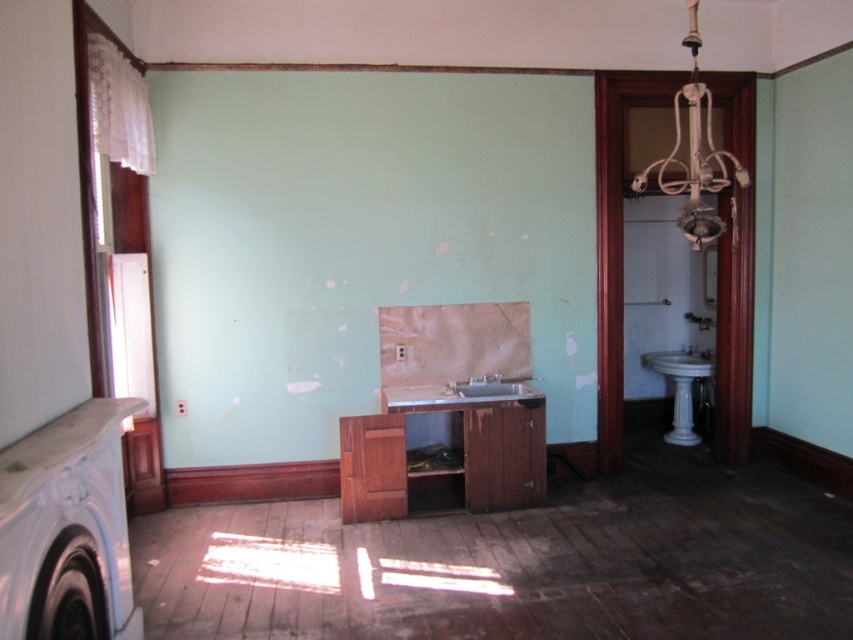
Can you confirm if white matte chandelier at upper right is smaller than white marble pedestal at right?

No, white matte chandelier at upper right is not smaller than white marble pedestal at right.

Between point (708, 138) and point (676, 419), which one is positioned behind?

The point (676, 419) is more distant.

At what (x,y) coordinates should I click in order to perform the action: click on white matte chandelier at upper right. Please return your answer as a coordinate pair (x, y). Looking at the image, I should click on (694, 154).

Between white matte chandelier at upper right and matte white sink at center, which one is positioned higher?

white matte chandelier at upper right is higher up.

Describe the element at coordinates (694, 154) in the screenshot. The image size is (853, 640). I see `white matte chandelier at upper right` at that location.

Who is more forward, [699,134] or [515,381]?

Positioned in front is point [699,134].

Locate an element on the screen. This screenshot has height=640, width=853. white matte chandelier at upper right is located at coordinates (694, 154).

Who is positioned more to the right, wooden cabinet at center or white matte chandelier at upper right?

white matte chandelier at upper right

Does wooden cabinet at center have a greater width compared to white matte chandelier at upper right?

Yes, wooden cabinet at center is wider than white matte chandelier at upper right.

Between point (508, 477) and point (635, 188), which one is positioned behind?

The point (508, 477) is more distant.

Locate an element on the screen. wooden cabinet at center is located at coordinates (445, 467).